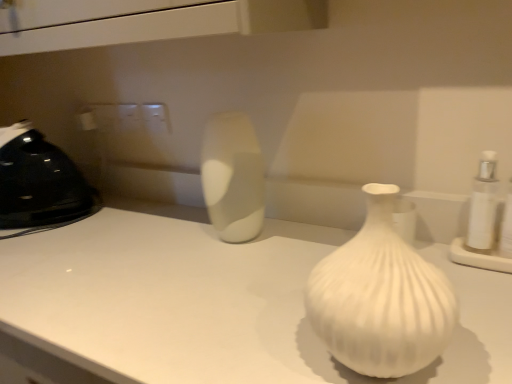
Question: From a real-world perspective, is satin white vase at center, the first vase from the back, beneath white ribbed vase at center, the first vase viewed from the front?

Choices:
 (A) yes
 (B) no

Answer: (B)

Question: Does satin white vase at center, which is the second vase from front to back, have a lesser width compared to white ribbed vase at center, marked as the 2th vase in a back-to-front arrangement?

Choices:
 (A) no
 (B) yes

Answer: (B)

Question: From the image's perspective, is satin white vase at center, which is the second vase from front to back, below white ribbed vase at center, marked as the 2th vase in a back-to-front arrangement?

Choices:
 (A) no
 (B) yes

Answer: (A)

Question: From the image's perspective, is satin white vase at center, which is the second vase from front to back, above white ribbed vase at center, the first vase viewed from the front?

Choices:
 (A) yes
 (B) no

Answer: (A)

Question: Does satin white vase at center, the first vase from the back, appear on the right side of white ribbed vase at center, the first vase viewed from the front?

Choices:
 (A) yes
 (B) no

Answer: (B)

Question: Looking at their shapes, would you say white matte counter top at center is wider or thinner than satin white vase at center, which is the second vase from front to back?

Choices:
 (A) thin
 (B) wide

Answer: (B)

Question: From the image's perspective, relative to satin white vase at center, the first vase from the back, is white matte counter top at center above or below?

Choices:
 (A) below
 (B) above

Answer: (A)

Question: Is white matte counter top at center inside the boundaries of satin white vase at center, which is the second vase from front to back, or outside?

Choices:
 (A) outside
 (B) inside

Answer: (A)

Question: Would you say white matte counter top at center is to the left or to the right of satin white vase at center, the first vase from the back, in the picture?

Choices:
 (A) left
 (B) right

Answer: (A)

Question: Is satin white vase at center, the first vase from the back, inside the boundaries of black plastic iron at left, or outside?

Choices:
 (A) inside
 (B) outside

Answer: (B)

Question: In terms of width, does satin white vase at center, which is the second vase from front to back, look wider or thinner when compared to black plastic iron at left?

Choices:
 (A) wide
 (B) thin

Answer: (B)

Question: Is satin white vase at center, which is the second vase from front to back, in front of or behind black plastic iron at left in the image?

Choices:
 (A) behind
 (B) front

Answer: (B)

Question: Considering the positions of satin white vase at center, the first vase from the back, and black plastic iron at left in the image, is satin white vase at center, the first vase from the back, bigger or smaller than black plastic iron at left?

Choices:
 (A) small
 (B) big

Answer: (A)

Question: Is black plastic iron at left taller or shorter than white matte counter top at center?

Choices:
 (A) tall
 (B) short

Answer: (B)

Question: Considering the relative positions of black plastic iron at left and white matte counter top at center in the image provided, is black plastic iron at left to the left or to the right of white matte counter top at center?

Choices:
 (A) left
 (B) right

Answer: (A)